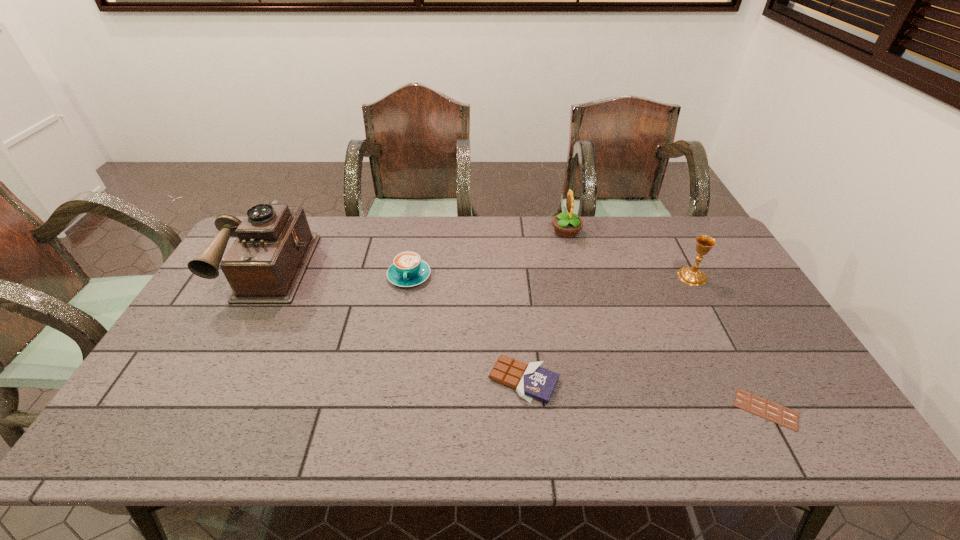
Identify the location of the leftmost object. The width and height of the screenshot is (960, 540). (266, 263).

This screenshot has width=960, height=540. I want to click on the tallest object, so click(266, 263).

Where is `sunflower`? The image size is (960, 540). sunflower is located at coordinates (566, 225).

Locate an element on the screen. chalice is located at coordinates (692, 276).

At what (x,y) coordinates should I click in order to perform the action: click on the third shortest object. Please return your answer as a coordinate pair (x, y). Looking at the image, I should click on (407, 270).

Image resolution: width=960 pixels, height=540 pixels. In order to click on cappuccino in this screenshot , I will do `click(407, 270)`.

The image size is (960, 540). What are the coordinates of `the taller chocolate bar` in the screenshot? It's located at (531, 381).

Locate an element on the screen. The height and width of the screenshot is (540, 960). the fourth object from right to left is located at coordinates (531, 381).

Locate an element on the screen. The image size is (960, 540). the shorter chocolate bar is located at coordinates (786, 417).

Locate an element on the screen. Image resolution: width=960 pixels, height=540 pixels. the right chocolate bar is located at coordinates (786, 417).